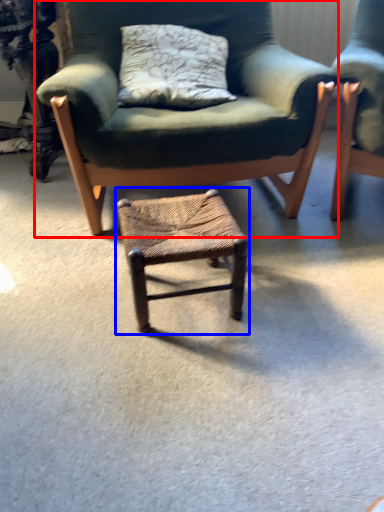
Question: Which object appears farthest to the camera in this image, chair (highlighted by a red box) or stool (highlighted by a blue box)?

Choices:
 (A) chair
 (B) stool

Answer: (A)